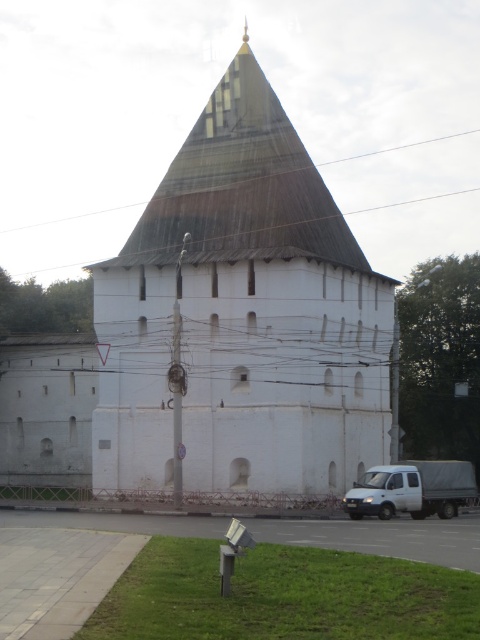
Question: Which of the following is the farthest from the observer?

Choices:
 (A) brown wooden power line at upper center
 (B) white matte truck at lower right

Answer: (A)

Question: Can you confirm if white stone chapel at center is thinner than white matte truck at lower right?

Choices:
 (A) yes
 (B) no

Answer: (B)

Question: Which point is closer to the camera taking this photo?

Choices:
 (A) (66, 218)
 (B) (264, 96)
 (C) (432, 508)

Answer: (C)

Question: Which point is closer to the camera?

Choices:
 (A) (235, 342)
 (B) (361, 209)
 (C) (430, 481)

Answer: (C)

Question: Can you confirm if white matte truck at lower right is positioned to the left of brown wooden power line at upper center?

Choices:
 (A) yes
 (B) no

Answer: (B)

Question: Is white stone chapel at center to the right of white matte truck at lower right from the viewer's perspective?

Choices:
 (A) no
 (B) yes

Answer: (A)